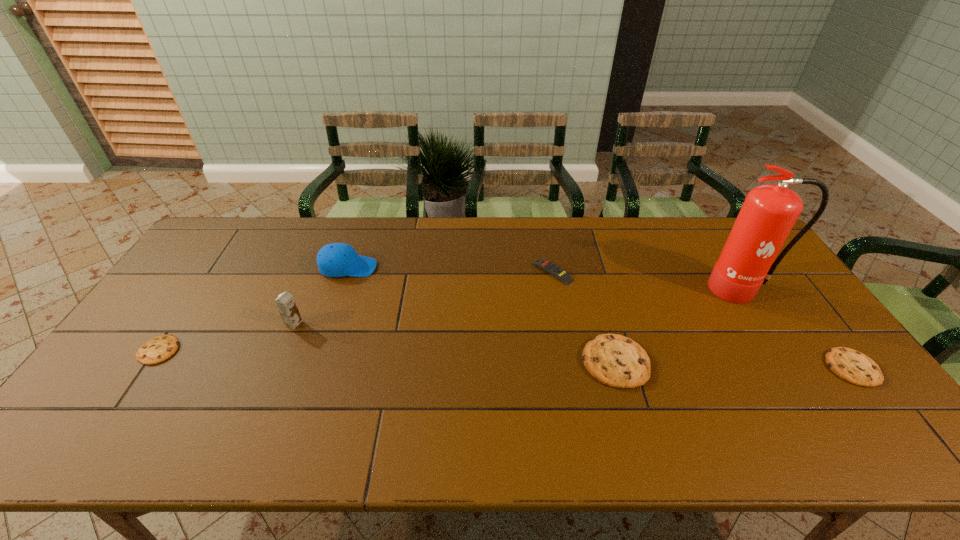
Image resolution: width=960 pixels, height=540 pixels. I want to click on fire extinguisher that is at the right edge, so click(769, 212).

Identify the location of object that is positioned at the near right corner. This screenshot has width=960, height=540. (850, 365).

In the image, there is a desktop. At what (x,y) coordinates should I click in order to perform the action: click on vacant space at the far edge. Please return your answer as a coordinate pair (x, y). Image resolution: width=960 pixels, height=540 pixels. Looking at the image, I should click on (704, 256).

In the image, there is a desktop. At what (x,y) coordinates should I click in order to perform the action: click on free space at the near edge. Please return your answer as a coordinate pair (x, y). The height and width of the screenshot is (540, 960). Looking at the image, I should click on (442, 411).

Locate an element on the screen. The image size is (960, 540). free point at the far left corner is located at coordinates (218, 230).

Locate an element on the screen. This screenshot has width=960, height=540. unoccupied position between the leftmost object and the fire extinguisher is located at coordinates (451, 320).

I want to click on vacant area between the fire extinguisher and the rightmost cookie, so click(798, 328).

The height and width of the screenshot is (540, 960). I want to click on free space between the tallest object and the remote control, so click(648, 280).

Identify the location of empty space that is in between the rightmost cookie and the chocolate milk. The image size is (960, 540). (573, 346).

I want to click on vacant point located between the cap and the remote control, so click(x=450, y=269).